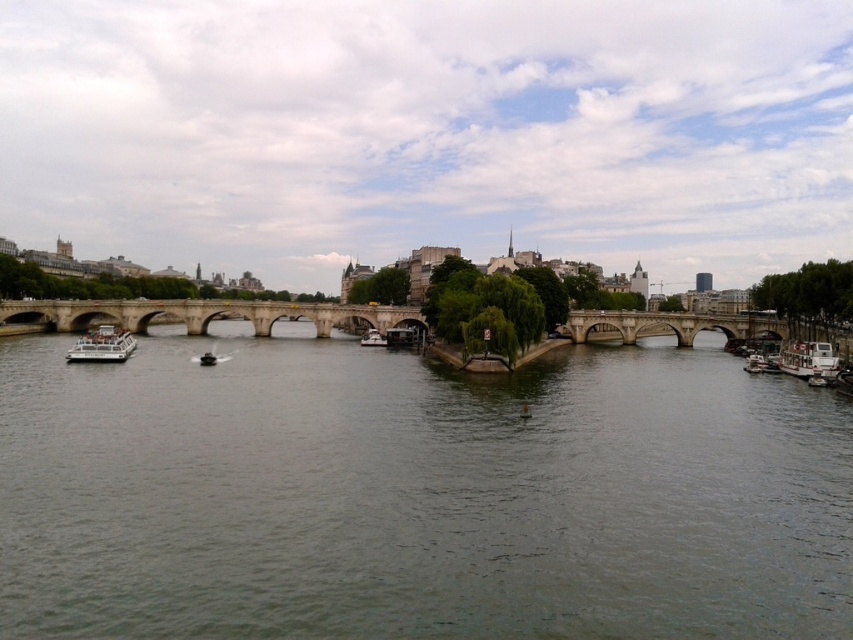
Question: Based on their relative distances, which object is nearer to the white glossy boat at center?

Choices:
 (A) gray concrete river at center
 (B) stone bridge at center
 (C) white glossy boat at right
 (D) white matte boat at lower left

Answer: (B)

Question: Does white matte boat at lower left lie in front of white glossy boat at right?

Choices:
 (A) yes
 (B) no

Answer: (B)

Question: Does gray concrete river at center have a smaller size compared to white glossy boat at center?

Choices:
 (A) yes
 (B) no

Answer: (B)

Question: Which object appears farthest from the camera in this image?

Choices:
 (A) white glossy boat at center
 (B) gray concrete river at center
 (C) white glossy boat at right

Answer: (A)

Question: Which object appears closest to the camera in this image?

Choices:
 (A) gray concrete river at center
 (B) white glossy boat at right
 (C) white glossy boat at center

Answer: (A)

Question: Does white matte boat at lower left have a larger size compared to white glossy boat at center?

Choices:
 (A) yes
 (B) no

Answer: (A)